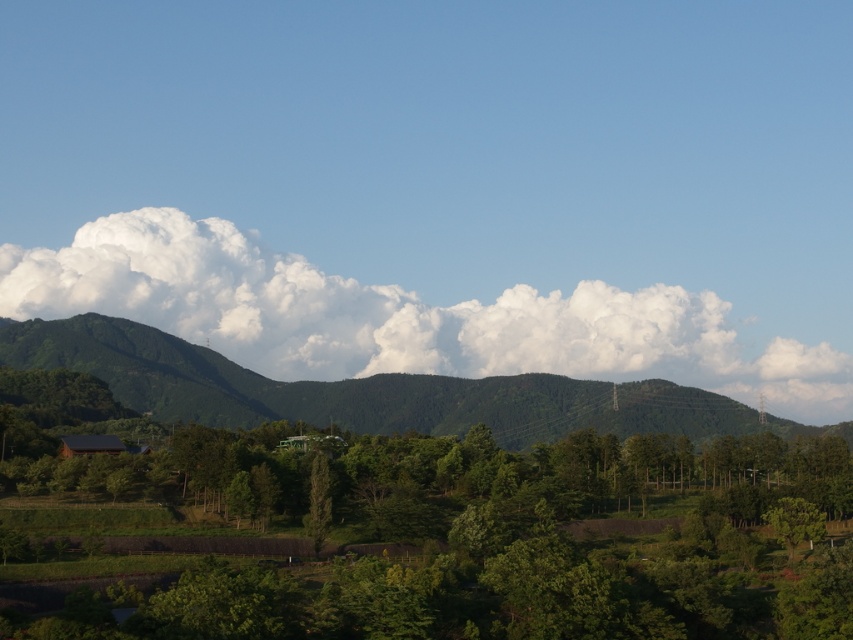
Measure the distance from white fluffy cloud at upper center to green textured tree at center.

426.01 meters

Between point (497, 304) and point (314, 468), which one is positioned behind?

The point (497, 304) is more distant.

Which is in front, point (395, 301) or point (318, 488)?

Positioned in front is point (318, 488).

The height and width of the screenshot is (640, 853). Find the location of `white fluffy cloud at upper center`. white fluffy cloud at upper center is located at coordinates point(402,316).